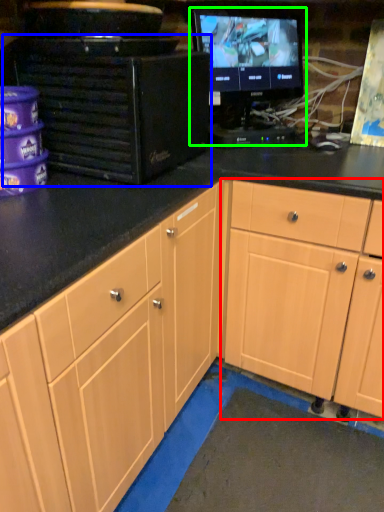
Question: Estimate the real-world distances between objects in this image. Which object is farther from cabinetry (highlighted by a red box), desktop computer (highlighted by a blue box) or computer monitor (highlighted by a green box)?

Choices:
 (A) desktop computer
 (B) computer monitor

Answer: (B)